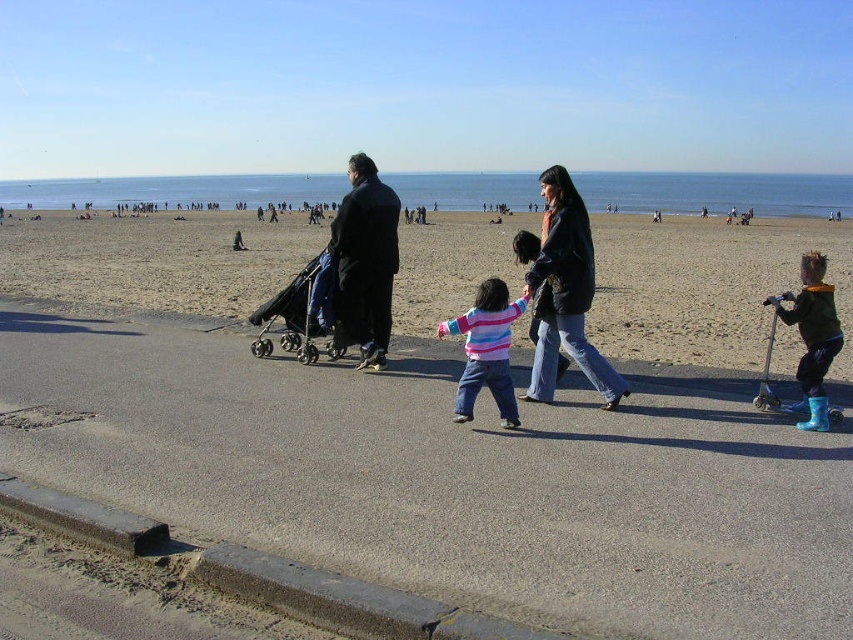
You are standing on the beach and see the point at coordinates (x=566, y=292). What object is located at that point?

The matte black jacket at center is located at point (x=566, y=292).

You are standing at the camera position and see two points marked on the image. Which point, point (579, 268) or point (384, 284), is closer to you?

Point (579, 268) is closer to you than point (384, 284).

Consider the image. You are a photographer trying to capture a photo of the beach scene. You notice the black matte coat at center and the dark blue plastic baby carriage at center. Which object should you focus on if you want to include both but ensure the larger one is prominent?

The black matte coat at center is bigger than the dark blue plastic baby carriage at center, so you should focus on the black matte coat at center to ensure the larger object is prominent in the photo.